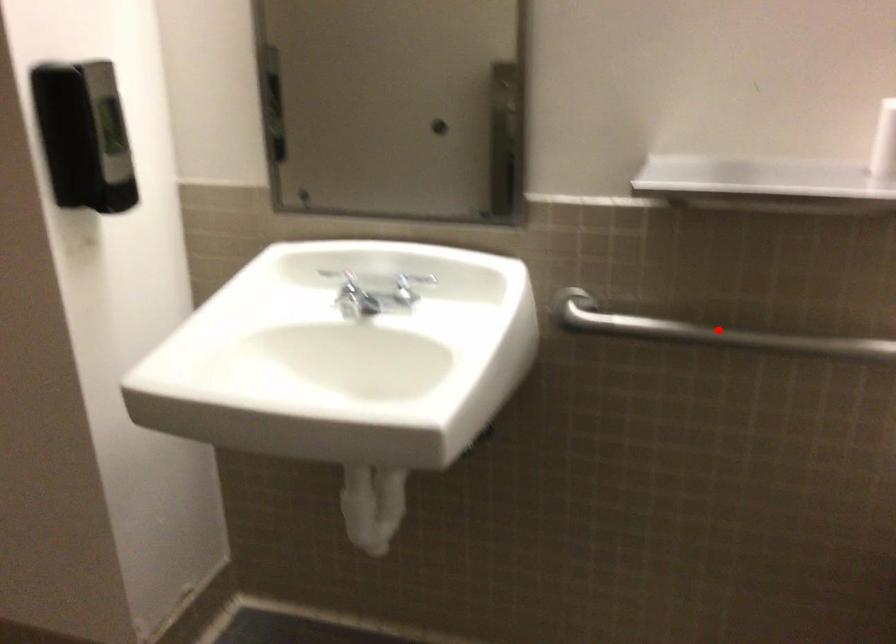
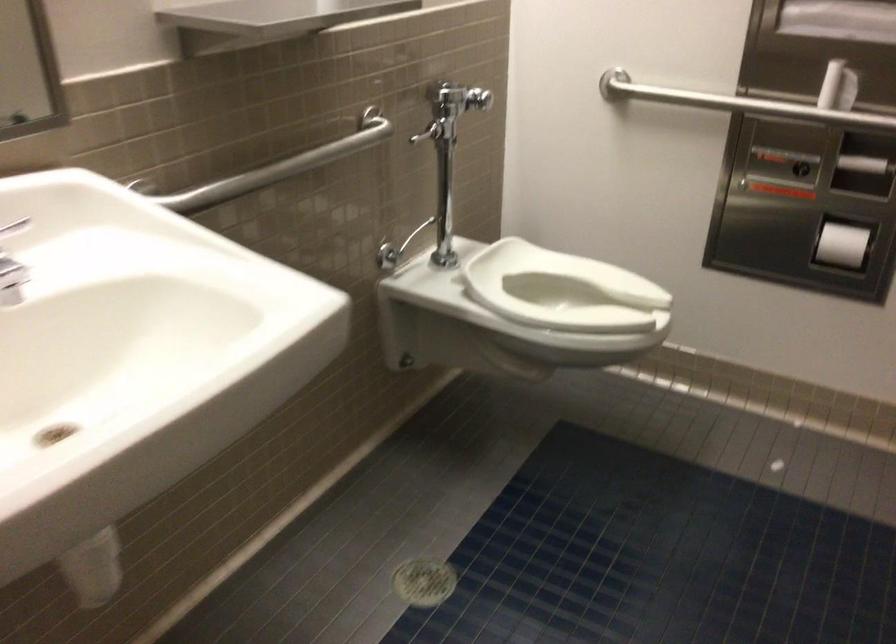
Question: I am providing you with two images of the same scene from different viewpoints. In image1, a red point is highlighted. Considering the same 3D point in image2, which of the following is correct?

Choices:
 (A) It is closer
 (B) It is farther

Answer: (B)